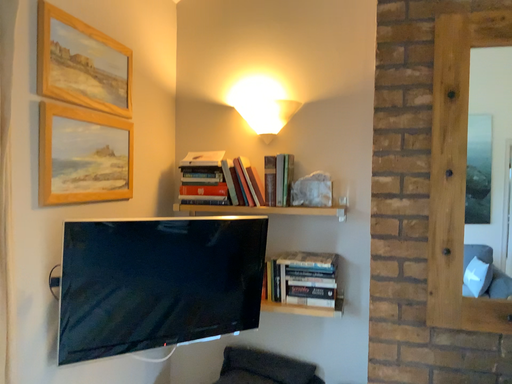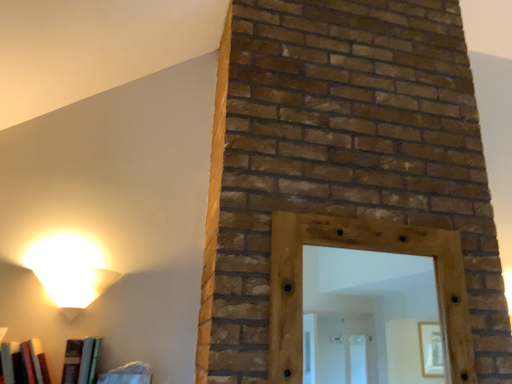
Question: Which way did the camera rotate in the video?

Choices:
 (A) rotated upward
 (B) rotated downward

Answer: (A)